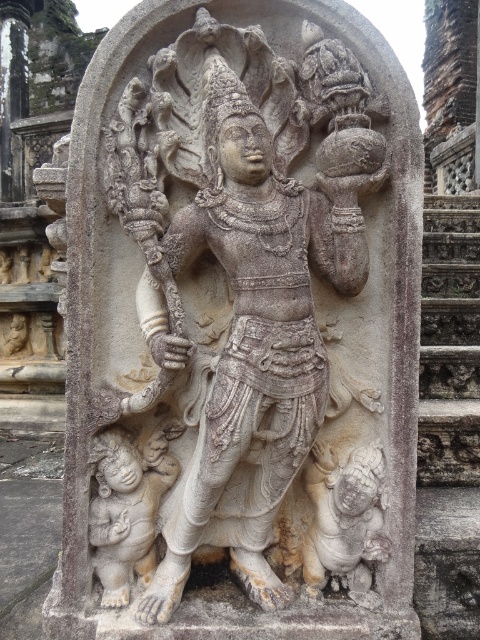
Question: From the image, what is the correct spatial relationship of gray stone stairs at center in relation to smooth beige statue at lower left?

Choices:
 (A) above
 (B) below

Answer: (A)

Question: Can you confirm if gray stone stairs at center is positioned to the right of smooth beige statue at lower left?

Choices:
 (A) no
 (B) yes

Answer: (B)

Question: Which of the following is the closest to the observer?

Choices:
 (A) gray stone statue at center
 (B) gray stone stairs at center

Answer: (A)

Question: Among these objects, which one is nearest to the camera?

Choices:
 (A) gray stone stairs at center
 (B) gray stone statue at center

Answer: (B)

Question: Is the position of gray stone stairs at center less distant than that of smooth beige statue at lower left?

Choices:
 (A) no
 (B) yes

Answer: (A)

Question: Which object is the closest to the smooth beige statue at lower left?

Choices:
 (A) gray stone stairs at center
 (B) gray stone statue at center

Answer: (B)